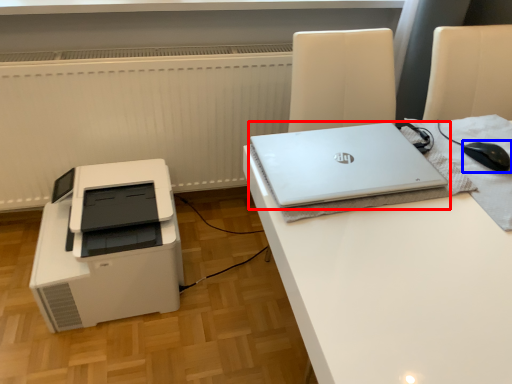
Question: Which point is further to the camera, laptop (highlighted by a red box) or mouse (highlighted by a blue box)?

Choices:
 (A) laptop
 (B) mouse

Answer: (B)